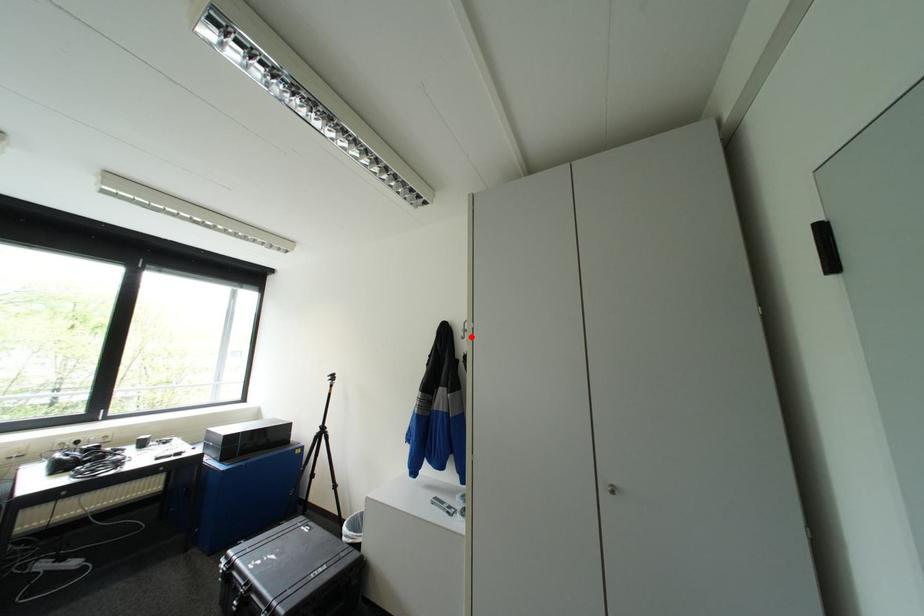
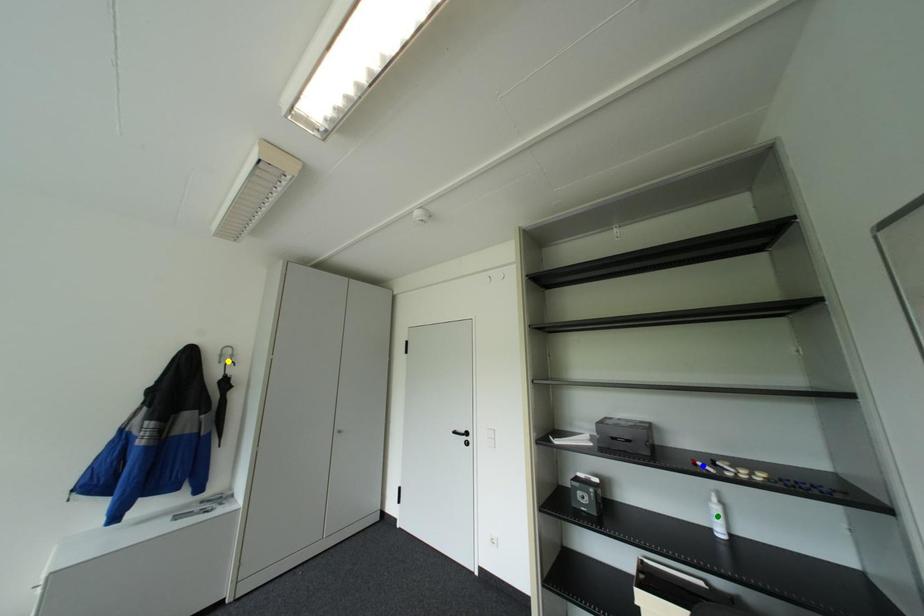
Question: I am providing you with two images of the same scene from different viewpoints. A red point is marked on the first image. You are given multiple points on the second image. Which mark in image 2 goes with the point in image 1?

Choices:
 (A) yellow point
 (B) blue point
 (C) green point

Answer: (A)